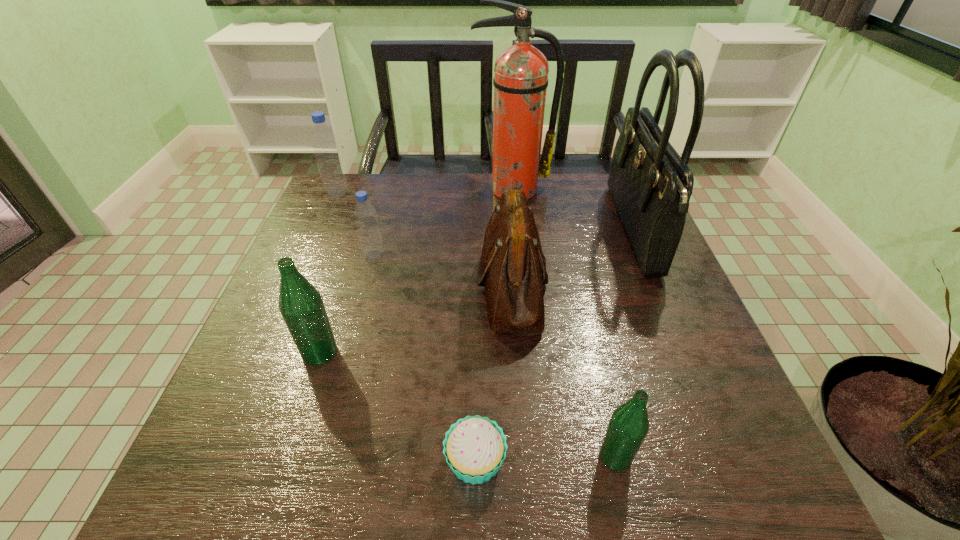
At what (x,y) coordinates should I click in order to perform the action: click on free area in between the rightmost object and the farther green bottle. Please return your answer as a coordinate pair (x, y). Looking at the image, I should click on (476, 292).

Where is `vacant space that's between the white cupcake and the brown shoulder bag`? The image size is (960, 540). vacant space that's between the white cupcake and the brown shoulder bag is located at coordinates (493, 373).

Locate an element on the screen. The width and height of the screenshot is (960, 540). vacant region between the shortest object and the right green bottle is located at coordinates (545, 458).

Find the location of `empty location between the shortest object and the farthest bottle`. empty location between the shortest object and the farthest bottle is located at coordinates (406, 327).

You are a GUI agent. You are given a task and a screenshot of the screen. Output one action in this format:
    pyautogui.click(x=<x>, y=<y>)
    Task: Click on the empty space between the white cupcake and the third farthest bottle
    
    Given the screenshot: What is the action you would take?
    pyautogui.click(x=397, y=407)

Where is `vacant area that lies between the shortest object and the farthest bottle`? The width and height of the screenshot is (960, 540). vacant area that lies between the shortest object and the farthest bottle is located at coordinates (406, 327).

I want to click on free spot between the farther green bottle and the leftmost bottle, so click(328, 273).

I want to click on empty location between the handbag and the right green bottle, so click(x=624, y=343).

The height and width of the screenshot is (540, 960). I want to click on the sixth closest object to the black handbag, so click(301, 305).

The height and width of the screenshot is (540, 960). In order to click on object identified as the third closest to the farthest bottle in this screenshot , I will do `click(512, 267)`.